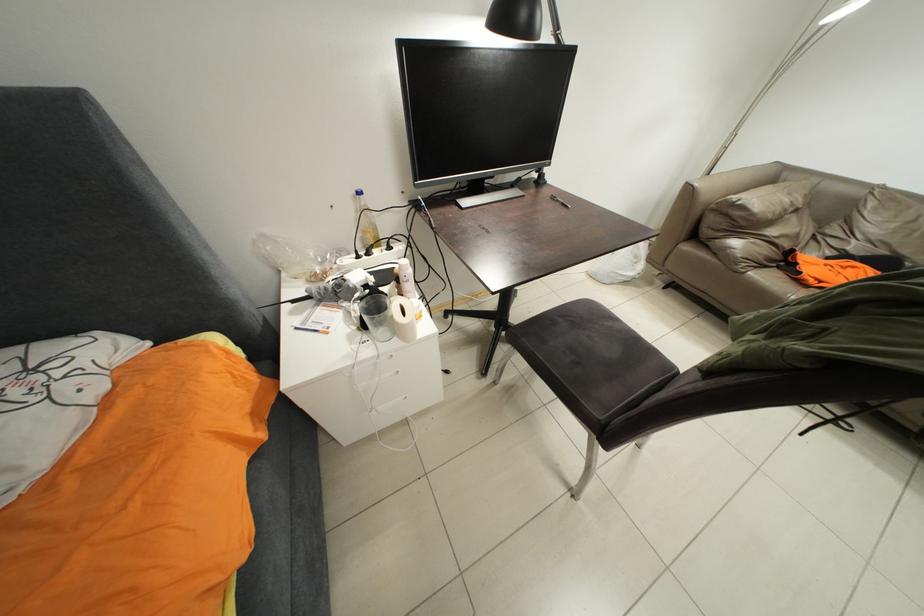
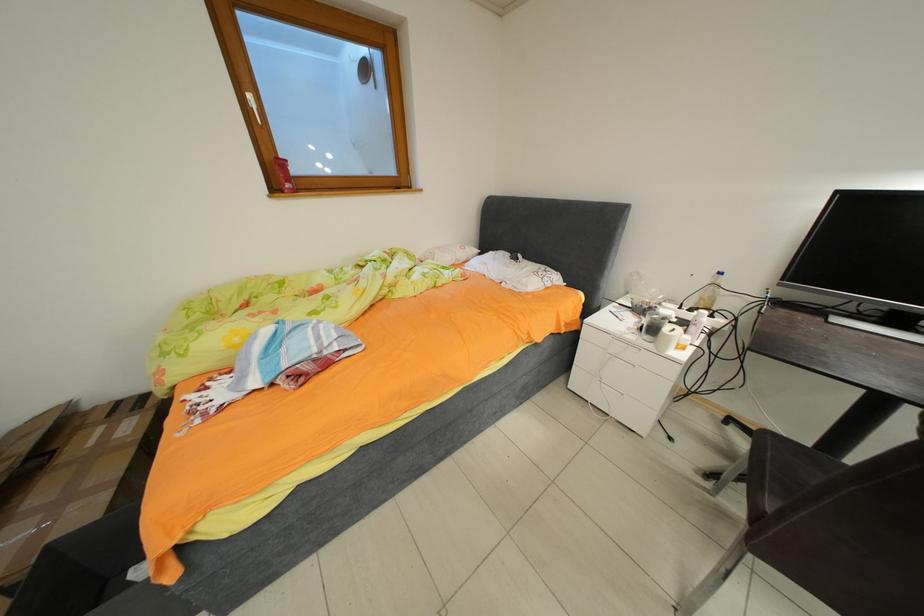
Question: Based on the continuous images, in which direction is the camera rotating? Reply with the corresponding letter.

Choices:
 (A) Left
 (B) Right
 (C) Up
 (D) Down

Answer: (A)